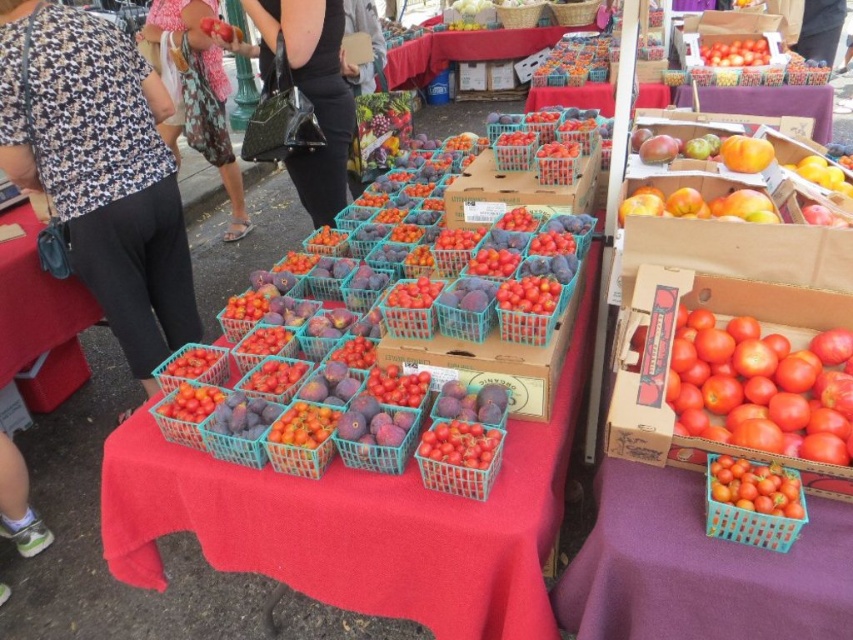
Question: Which is nearer to the woven straw basket at upper center?

Choices:
 (A) woven brown basket at upper center
 (B) black leather handbag at upper center
 (C) shiny red tomatoes at center
 (D) floral-patterned shirt at left

Answer: (A)

Question: Which object appears closest to the camera in this image?

Choices:
 (A) woven brown basket at upper center
 (B) shiny red tomatoes at center

Answer: (B)

Question: Is leather wallet at lower left wider than purple wood table at upper right?

Choices:
 (A) no
 (B) yes

Answer: (A)

Question: Does shiny red tomatoes at center appear under matte plastic baskets at center?

Choices:
 (A) yes
 (B) no

Answer: (A)

Question: Considering the relative positions of floral fabric dress at upper left and woven straw basket at upper center in the image provided, where is floral fabric dress at upper left located with respect to woven straw basket at upper center?

Choices:
 (A) left
 (B) right

Answer: (A)

Question: Which point is farther to the camera?

Choices:
 (A) (540, 6)
 (B) (451, 483)

Answer: (A)